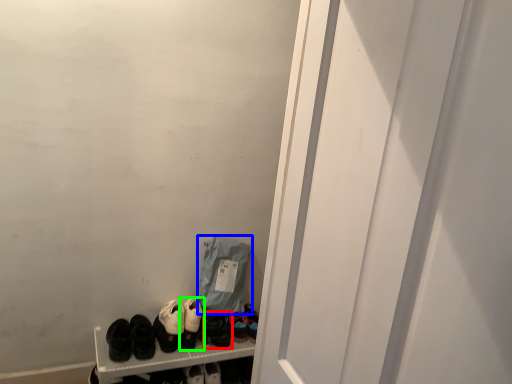
Question: Which object is positioned farthest from footwear (highlighted by a red box)? Select from bag (highlighted by a blue box) and footwear (highlighted by a green box).

Choices:
 (A) bag
 (B) footwear

Answer: (A)